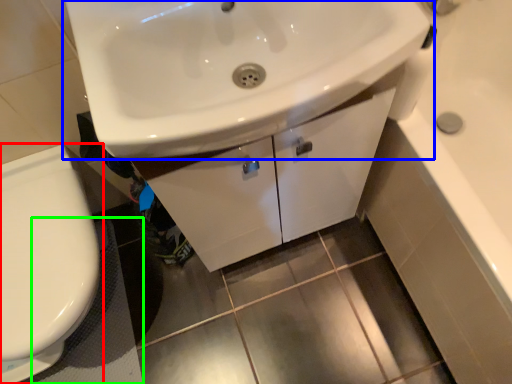
Question: Based on their relative distances, which object is nearer to toilet (highlighted by a red box)? Choose from sink (highlighted by a blue box) and bath mat (highlighted by a green box).

Choices:
 (A) sink
 (B) bath mat

Answer: (B)